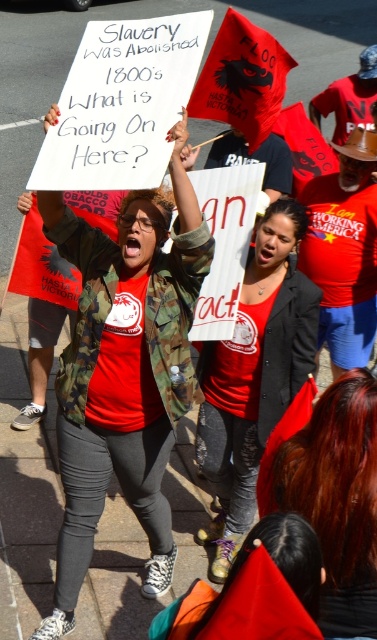
Question: Does matte black blazer at center appear on the right side of shiny red hair at center?

Choices:
 (A) no
 (B) yes

Answer: (A)

Question: Considering the real-world distances, which object is farthest from the matte black blazer at center?

Choices:
 (A) matte red t-shirt at center
 (B) shiny red hair at center

Answer: (B)

Question: Is matte red t-shirt at center wider than matte black blazer at center?

Choices:
 (A) yes
 (B) no

Answer: (A)

Question: Which of the following is the farthest from the observer?

Choices:
 (A) matte red t-shirt at center
 (B) matte black blazer at center

Answer: (B)

Question: Can you confirm if matte black blazer at center is wider than shiny red hair at center?

Choices:
 (A) yes
 (B) no

Answer: (A)

Question: Which object is the closest to the shiny red hair at center?

Choices:
 (A) matte red t-shirt at center
 (B) matte black blazer at center

Answer: (A)